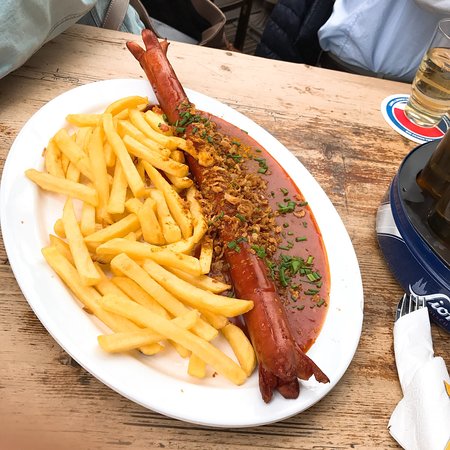
I want to click on coaster, so click(x=426, y=131).